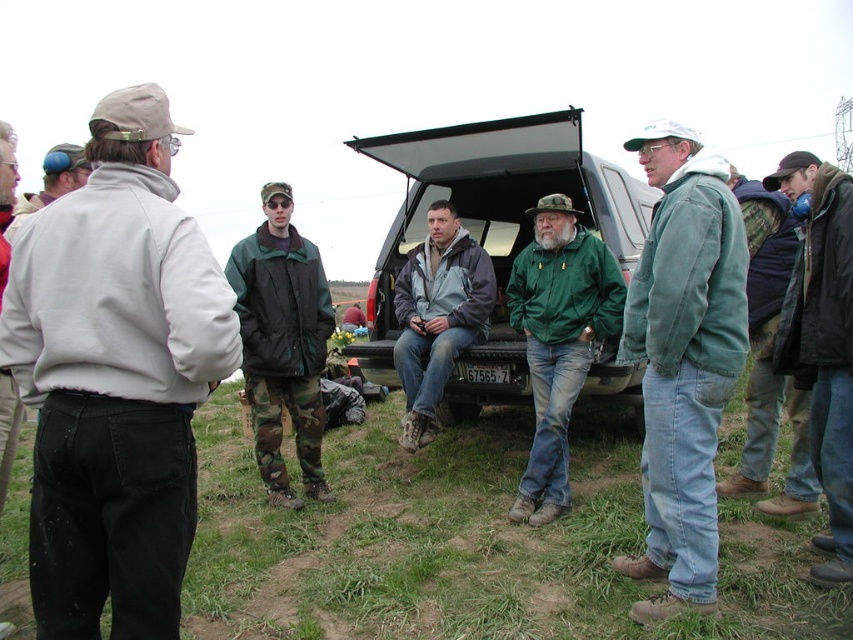
From the picture: Can you confirm if matte black truck at center is positioned above camouflage pants at center?

Correct, matte black truck at center is located above camouflage pants at center.

Can you confirm if matte black truck at center is smaller than camouflage pants at center?

No, matte black truck at center is not smaller than camouflage pants at center.

Which is behind, point (593, 202) or point (321, 317)?

The point (593, 202) is behind.

Locate an element on the screen. matte black truck at center is located at coordinates [491, 230].

Does light gray fleece jacket at left appear over gray-green jacket at center?

No, light gray fleece jacket at left is not above gray-green jacket at center.

Is point (10, 356) positioned behind point (460, 339)?

No, (10, 356) is in front of (460, 339).

This screenshot has height=640, width=853. Describe the element at coordinates (115, 378) in the screenshot. I see `light gray fleece jacket at left` at that location.

The image size is (853, 640). I want to click on light gray fleece jacket at left, so click(x=115, y=378).

Is light gray fleece jacket at left shorter than green matte jacket at center?

Indeed, light gray fleece jacket at left has a lesser height compared to green matte jacket at center.

Who is more distant from viewer, (132, 152) or (544, 291)?

The point (544, 291) is more distant.

At what (x,y) coordinates should I click in order to perform the action: click on light gray fleece jacket at left. Please return your answer as a coordinate pair (x, y). Looking at the image, I should click on (115, 378).